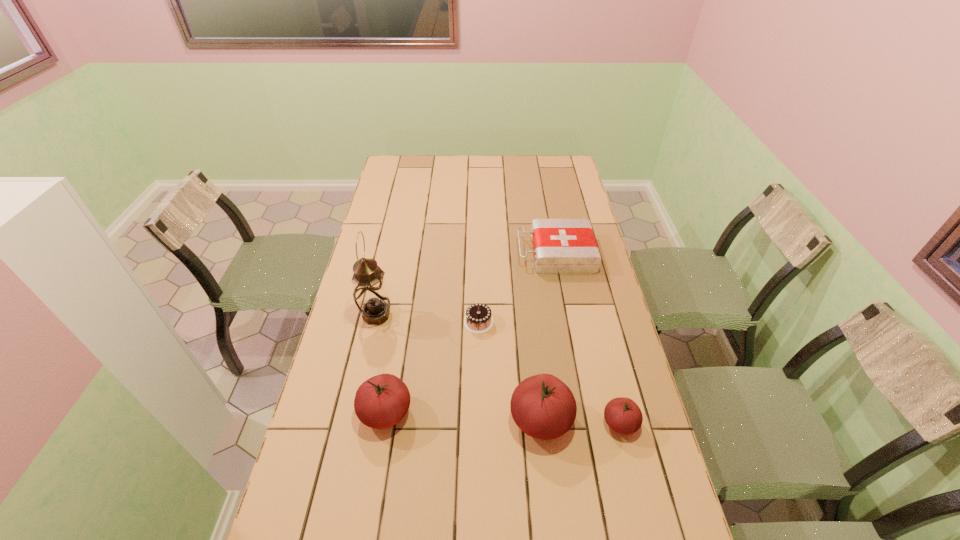
Locate an element on the screen. The width and height of the screenshot is (960, 540). vacant space that satisfies the following two spatial constraints: 1. on the front side of the farthest object; 2. on the front side of the third tallest object is located at coordinates (586, 412).

Locate an element on the screen. Image resolution: width=960 pixels, height=540 pixels. free space that satisfies the following two spatial constraints: 1. on the front side of the farthest object; 2. on the front side of the fourth shortest object is located at coordinates (586, 412).